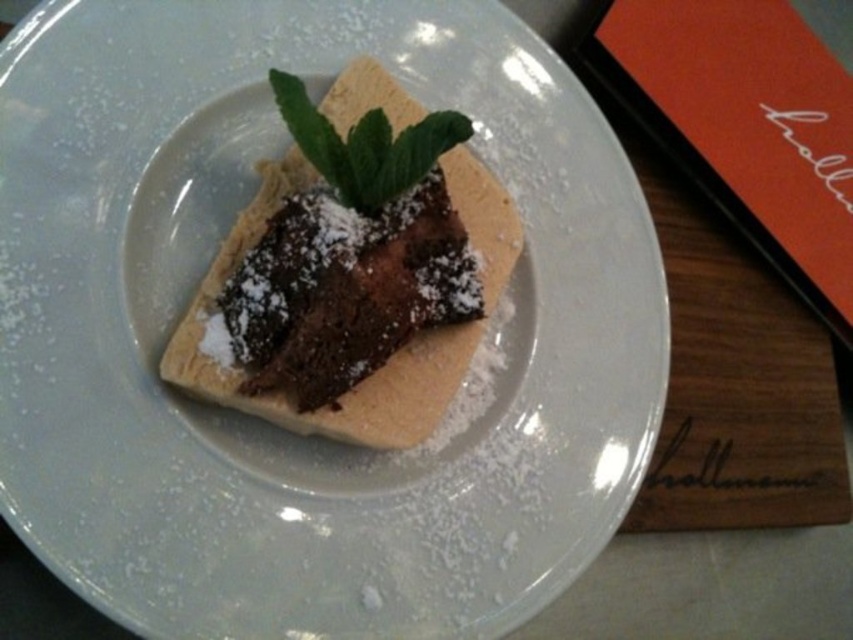
You are a food photographer trying to capture the dessert from the front. You notice two points on the plate. The first point is at coordinate point (409, 234) and the second is at point (288, 92). Which point is closer to the camera when taking the photo?

Point (288, 92) is closer to the camera since it is in front of point (409, 234) according to their positions.

You are a food stylist arranging the dessert plate. The customer wants the mint to be placed to the right of the brownie. Based on the current arrangement, is the green leafy mint at center positioned to the right of the chocolate matte brownie at center?

The chocolate matte brownie at center is to the left of green leafy mint at center, so yes, the green leafy mint at center is positioned to the right of the chocolate matte brownie at center.

You are a food stylist arranging this dessert. You need to ensure that the green leafy mint at center is visible above the chocolate matte brownie at center. Is the current arrangement allowing this?

The chocolate matte brownie at center has a greater height compared to the green leafy mint at center, so the mint may be partially obscured. Adjust the brownie or mint position to ensure visibility.